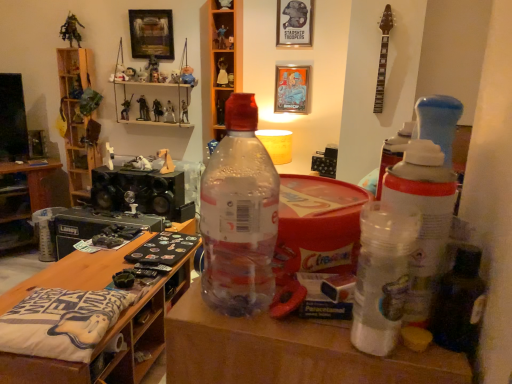
Locate an element on the screen. The width and height of the screenshot is (512, 384). vacant area on top of wooden shelf at left, the 1th shelf viewed from the left (from a real-world perspective) is located at coordinates (72, 45).